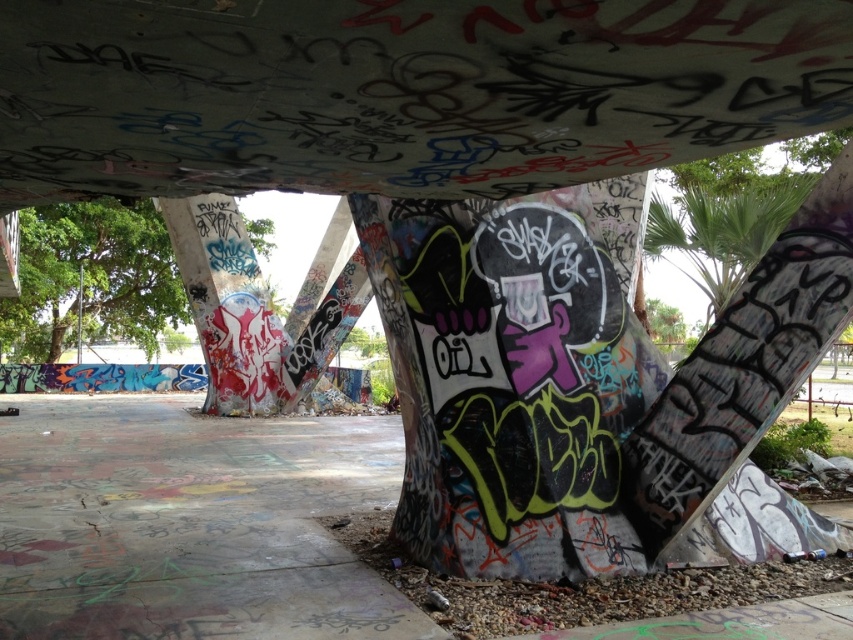
You are standing at the base of the concrete structure and want to take a photo of both point (71, 250) and point (210, 304). Which point should you focus on first to ensure both are in clear view?

You should focus on point (71, 250) first because it is closer to the camera than point (210, 304). This ensures both points are in focus as the depth of field will cover the farther point.